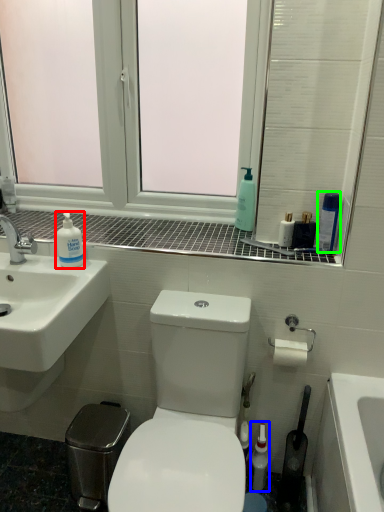
Question: Considering the real-world distances, which object is farthest from cleaning product (highlighted by a red box)? mouthwash (highlighted by a blue box) or cleaning product (highlighted by a green box)?

Choices:
 (A) mouthwash
 (B) cleaning product

Answer: (A)